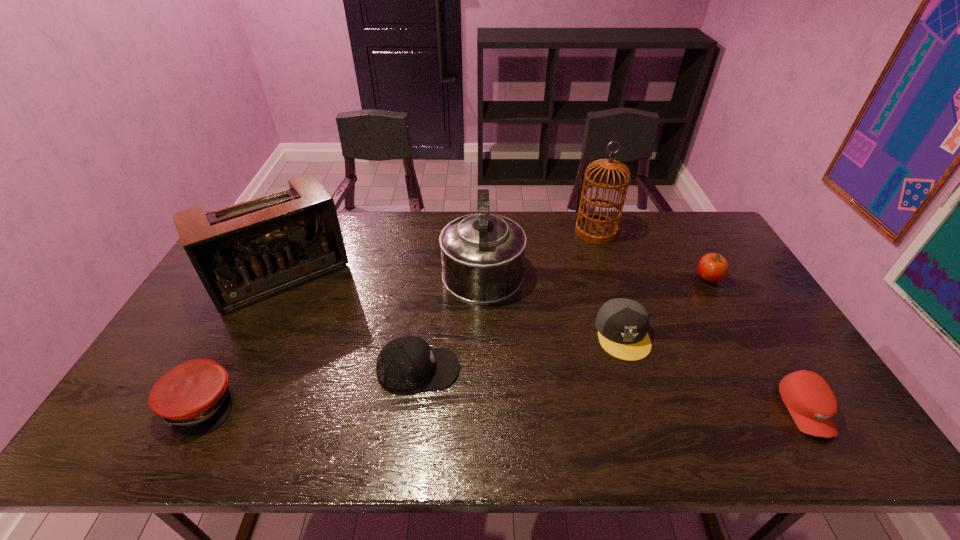
Identify the location of unoccupied area between the kettle and the second cap from right to left. (553, 300).

Identify the location of vacant region between the leftmost cap and the radio receiver. The image size is (960, 540). (241, 341).

The image size is (960, 540). I want to click on free space between the tallest object and the second cap from left to right, so click(507, 301).

This screenshot has height=540, width=960. I want to click on vacant point located between the kettle and the second cap from left to right, so click(x=450, y=318).

You are a GUI agent. You are given a task and a screenshot of the screen. Output one action in this format:
    pyautogui.click(x=<x>, y=<y>)
    Task: Click on the unoccupied position between the rightmost cap and the leftmost cap
    The image size is (960, 540).
    Given the screenshot: What is the action you would take?
    (503, 407)

Locate an element on the screen. The height and width of the screenshot is (540, 960). vacant area between the third cap from left to right and the birdcage is located at coordinates (610, 283).

The image size is (960, 540). I want to click on vacant space that's between the birdcage and the apple, so click(x=652, y=255).

This screenshot has height=540, width=960. Identify the location of free space between the tallest object and the apple. (652, 255).

This screenshot has width=960, height=540. Identify the location of object that can be found as the fifth closest to the third cap from left to right. (406, 364).

The image size is (960, 540). I want to click on object that ranks as the fourth closest to the tallest object, so click(x=406, y=364).